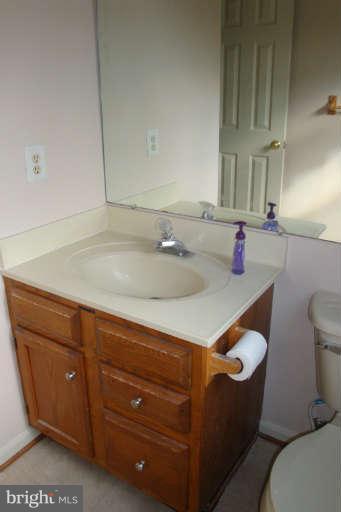
This screenshot has height=512, width=341. What are the coordinates of `socket` in the screenshot? It's located at (35, 170), (36, 161).